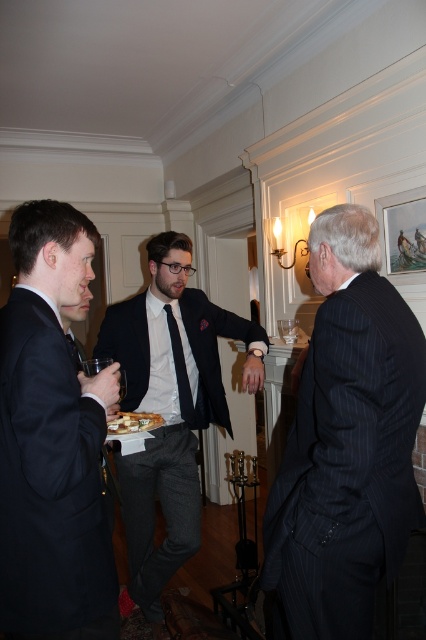
Question: Which of the following is the farthest from the observer?

Choices:
 (A) black silk tie at center
 (B) pinstriped suit at center

Answer: (A)

Question: Is matte black suit at center to the left of white glossy plate at center from the viewer's perspective?

Choices:
 (A) yes
 (B) no

Answer: (B)

Question: Can you confirm if pinstriped suit at center is bigger than white glossy plate at center?

Choices:
 (A) no
 (B) yes

Answer: (B)

Question: Can you confirm if matte black suit at center is positioned below white glossy plate at center?

Choices:
 (A) yes
 (B) no

Answer: (A)

Question: Which object is positioned farthest from the pinstriped suit at center?

Choices:
 (A) white glossy plate at center
 (B) matte black suit at center
 (C) black silk tie at center
 (D) matte black suit at left

Answer: (C)

Question: Which of these objects is positioned closest to the pinstriped suit at center?

Choices:
 (A) white glossy plate at center
 (B) matte black suit at left
 (C) black silk tie at center
 (D) matte black suit at center

Answer: (B)